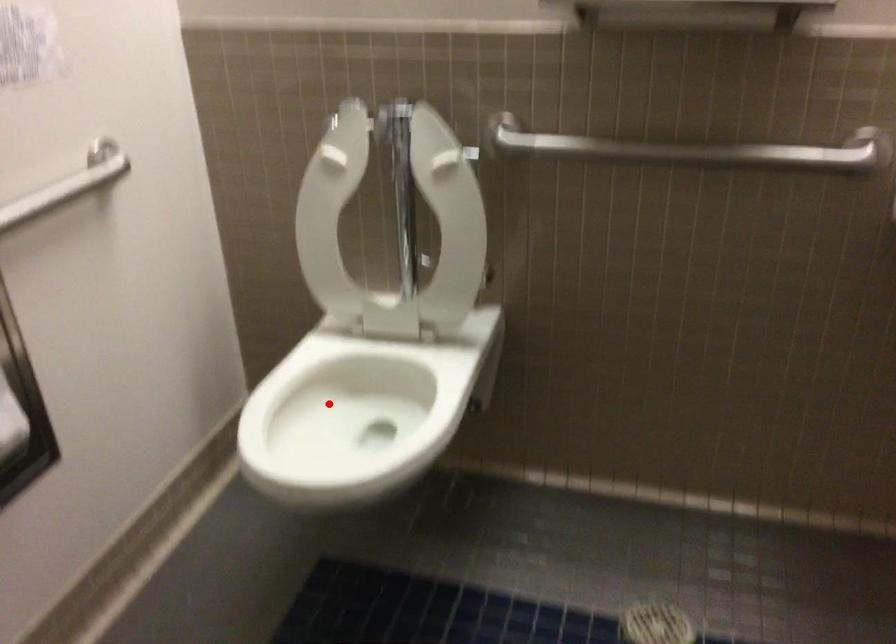
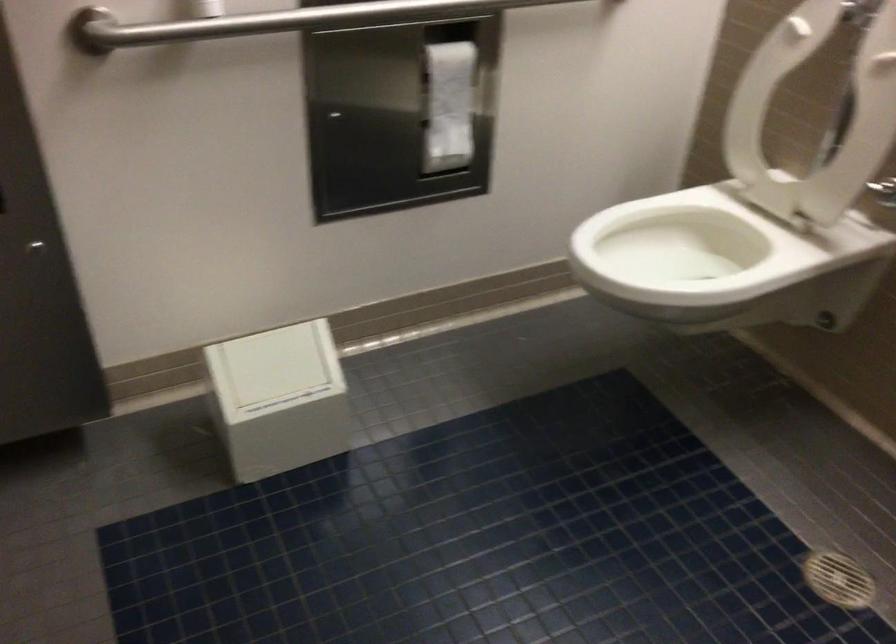
Question: I am providing you with two images of the same scene from different viewpoints. In image1, a red point is highlighted. Considering the same 3D point in image2, which of the following is correct?

Choices:
 (A) It is closer
 (B) It is farther

Answer: (B)